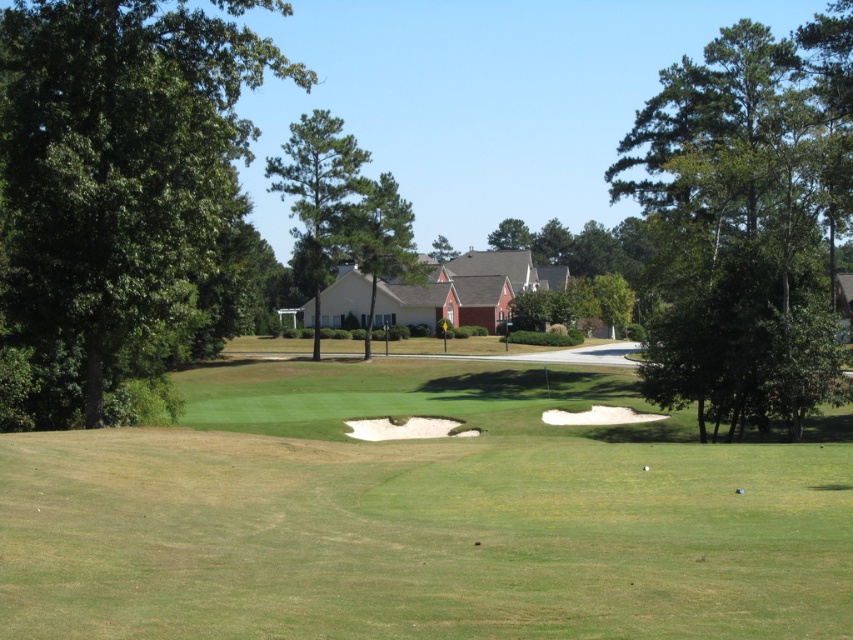
From the picture: Between green grassy golf course at center and green textured pine tree at center, which one has more height?

Standing taller between the two is green textured pine tree at center.

Is green grassy golf course at center above green textured pine tree at center?

No.

Locate an element on the screen. This screenshot has width=853, height=640. green grassy golf course at center is located at coordinates (421, 515).

Is point (374, 292) less distant than point (434, 253)?

Yes, it is.

Identify the location of green textured tree at center. The width and height of the screenshot is (853, 640). (378, 237).

Does white sand trap at center have a smaller size compared to white matte golf ball at center?

Incorrect, white sand trap at center is not smaller in size than white matte golf ball at center.

In order to click on white sand trap at center in this screenshot , I will do `click(405, 428)`.

Is point (386, 417) positioned behind point (643, 468)?

Yes, point (386, 417) is farther from viewer.

Where is `white sand trap at center`? white sand trap at center is located at coordinates (405, 428).